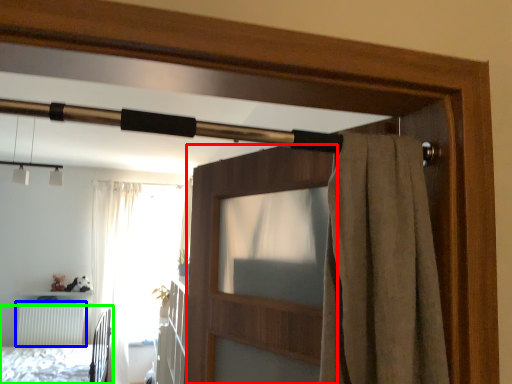
Question: Considering the real-world distances, which object is closest to screen door (highlighted by a red box)? radiator (highlighted by a blue box) or bed (highlighted by a green box).

Choices:
 (A) radiator
 (B) bed

Answer: (B)